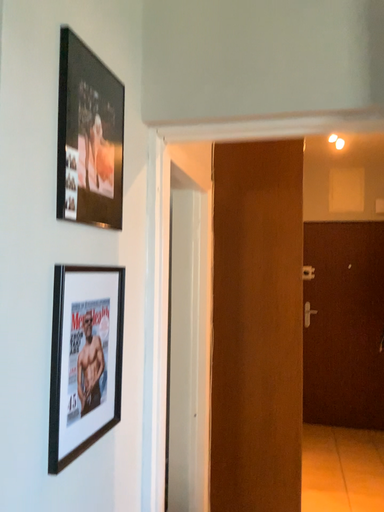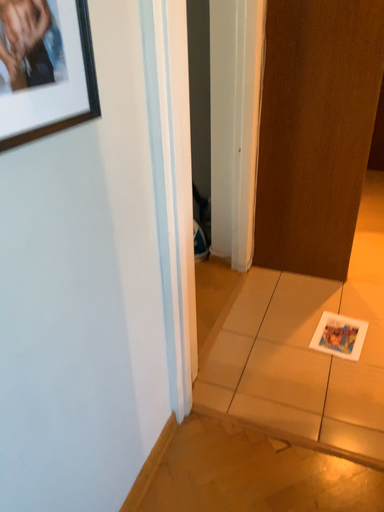
Question: How did the camera likely rotate when shooting the video?

Choices:
 (A) rotated right
 (B) rotated left

Answer: (B)